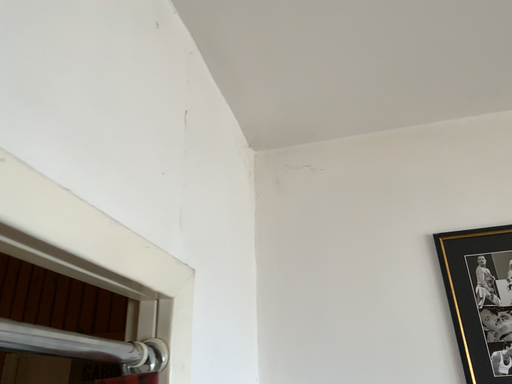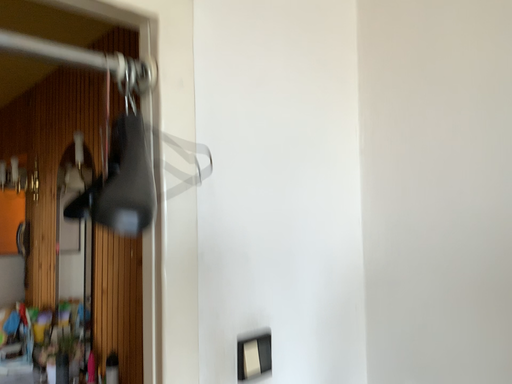
Question: Which way did the camera rotate in the video?

Choices:
 (A) rotated upward
 (B) rotated downward

Answer: (B)